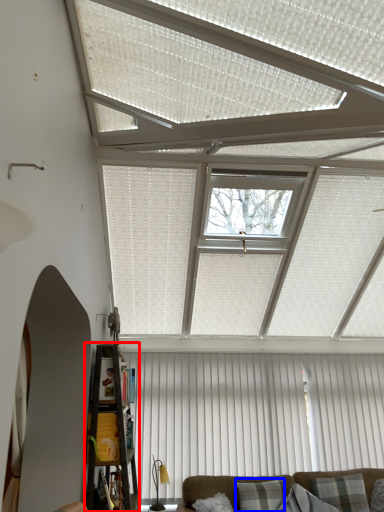
Question: Which object appears farthest to the camera in this image, shelf (highlighted by a red box) or pillow (highlighted by a blue box)?

Choices:
 (A) shelf
 (B) pillow

Answer: (B)